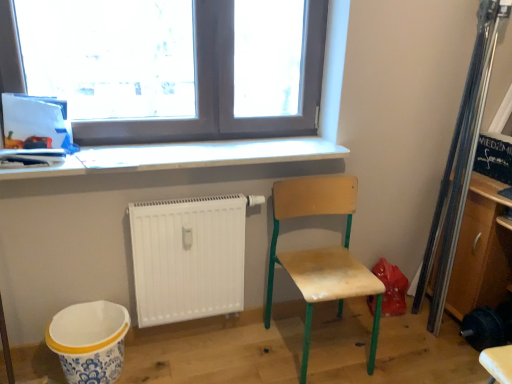
Where is `vacant space underneath white matte radiator at lower center (from a real-world perspective)`? The width and height of the screenshot is (512, 384). vacant space underneath white matte radiator at lower center (from a real-world perspective) is located at coordinates (218, 330).